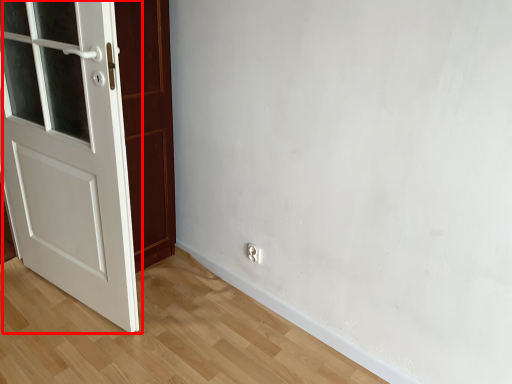
Question: In this image, where is door (annotated by the red box) located relative to electric outlet?

Choices:
 (A) left
 (B) right

Answer: (A)